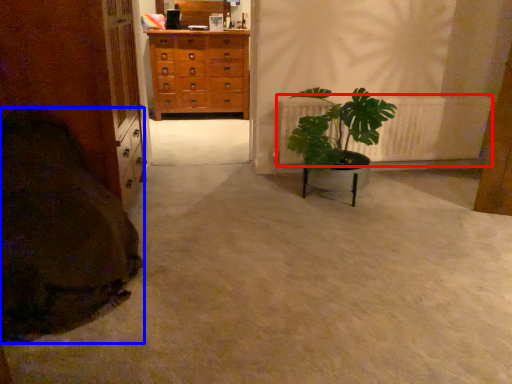
Question: Which object appears closest to the camera in this image, radiator (highlighted by a red box) or blanket (highlighted by a blue box)?

Choices:
 (A) radiator
 (B) blanket

Answer: (B)